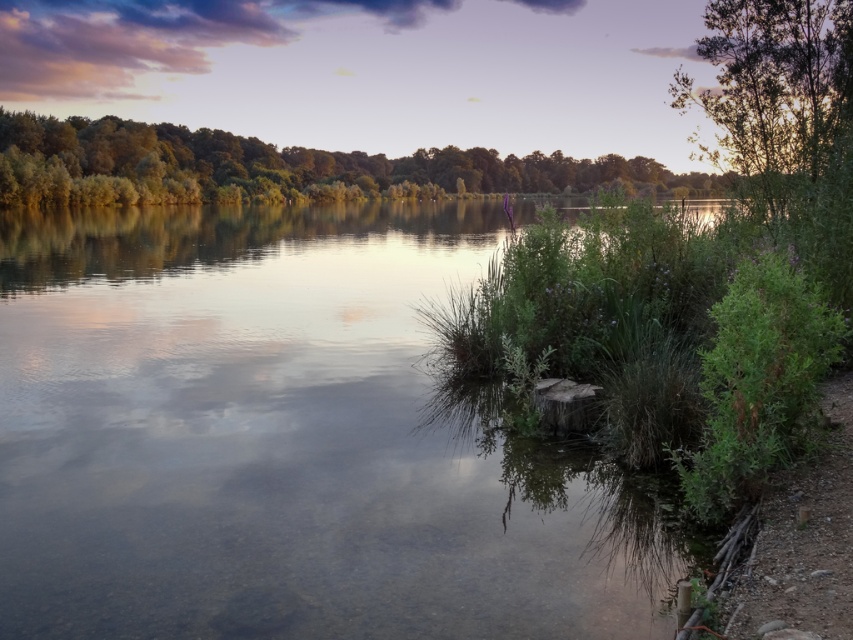
Is green leafy trees at upper left to the left of green leafy tree at upper right from the viewer's perspective?

Incorrect, green leafy trees at upper left is not on the left side of green leafy tree at upper right.

Measure the distance between green leafy trees at upper left and camera.

green leafy trees at upper left is 16.40 meters from camera.

Image resolution: width=853 pixels, height=640 pixels. In order to click on green leafy trees at upper left in this screenshot , I will do `click(280, 168)`.

Between point (109, 580) and point (567, 156), which one is positioned behind?

Positioned behind is point (567, 156).

The height and width of the screenshot is (640, 853). Describe the element at coordinates (283, 440) in the screenshot. I see `clear water at center` at that location.

Between point (518, 612) and point (416, 170), which one is positioned behind?

Point (416, 170)

This screenshot has width=853, height=640. I want to click on clear water at center, so click(x=283, y=440).

Is clear water at center to the right of green leafy tree at upper right from the viewer's perspective?

No, clear water at center is not to the right of green leafy tree at upper right.

This screenshot has height=640, width=853. What do you see at coordinates (283, 440) in the screenshot? I see `clear water at center` at bounding box center [283, 440].

Between point (305, 296) and point (805, 60), which one is positioned behind?

Positioned behind is point (305, 296).

I want to click on clear water at center, so click(x=283, y=440).